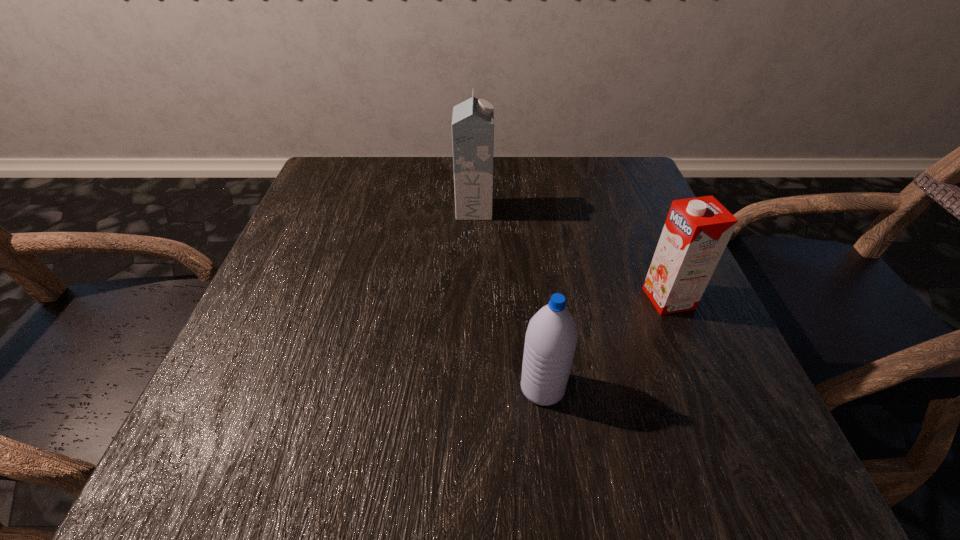
Find the location of `vacant space that satisfies the following two spatial constraints: 1. on the front label of the shorter carton; 2. on the left side of the farthest object`. vacant space that satisfies the following two spatial constraints: 1. on the front label of the shorter carton; 2. on the left side of the farthest object is located at coordinates (472, 298).

Find the location of a particular element. blank space that satisfies the following two spatial constraints: 1. on the front label of the tallest object; 2. on the left side of the second object from right to left is located at coordinates (471, 388).

The width and height of the screenshot is (960, 540). In order to click on vacant space that satisfies the following two spatial constraints: 1. on the front label of the right carton; 2. on the right side of the farthest object in this screenshot , I will do `click(472, 298)`.